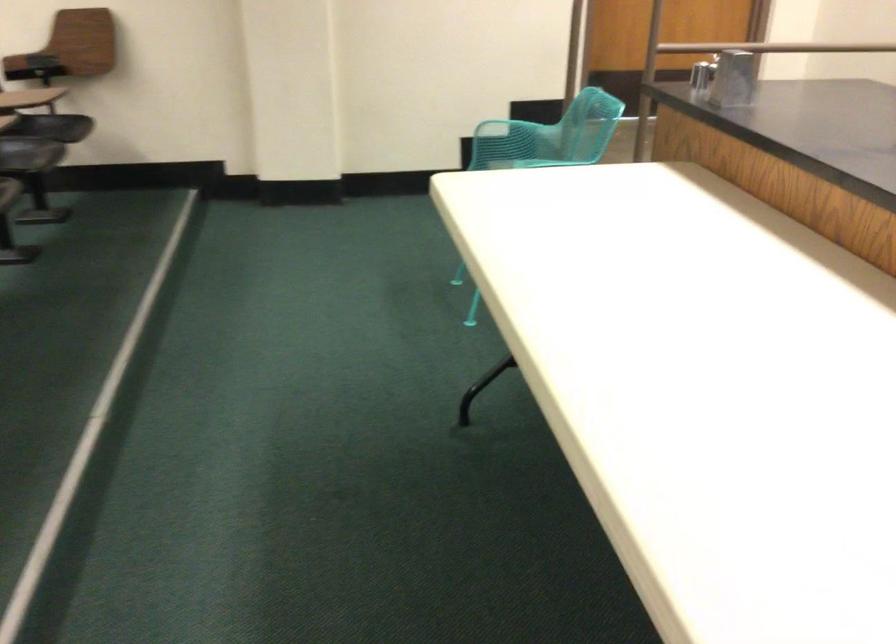
What do you see at coordinates (533, 111) in the screenshot? The height and width of the screenshot is (644, 896). I see `a chair armrest` at bounding box center [533, 111].